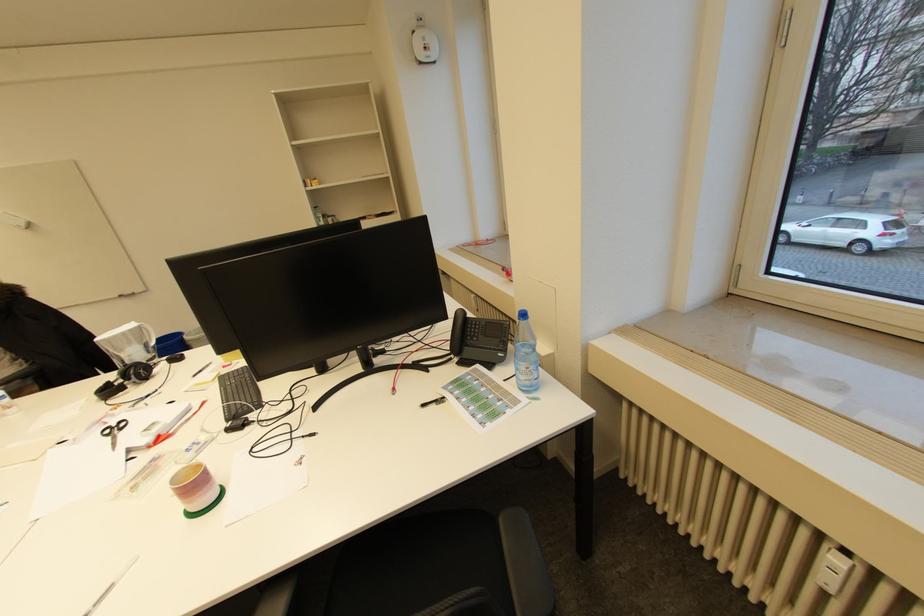
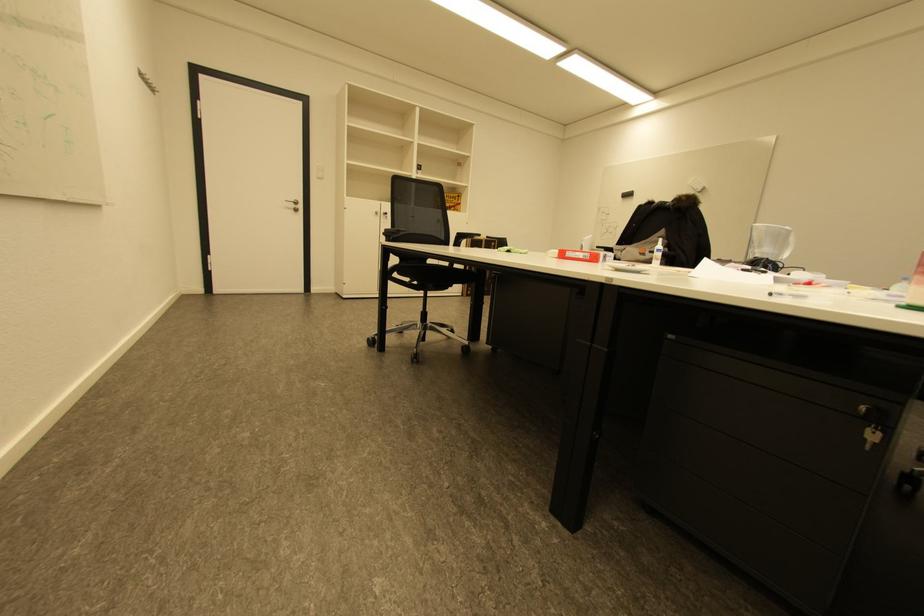
Question: The first image is from the beginning of the video and the second image is from the end. How did the camera likely rotate when shooting the video?

Choices:
 (A) Left
 (B) Right
 (C) Up
 (D) Down

Answer: (A)